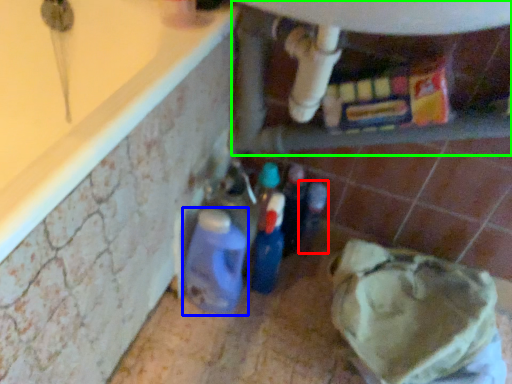
Question: Which object is the closest to the bottle (highlighted by a red box)? Choose among these: bottle (highlighted by a blue box) or water heater (highlighted by a green box).

Choices:
 (A) bottle
 (B) water heater

Answer: (A)